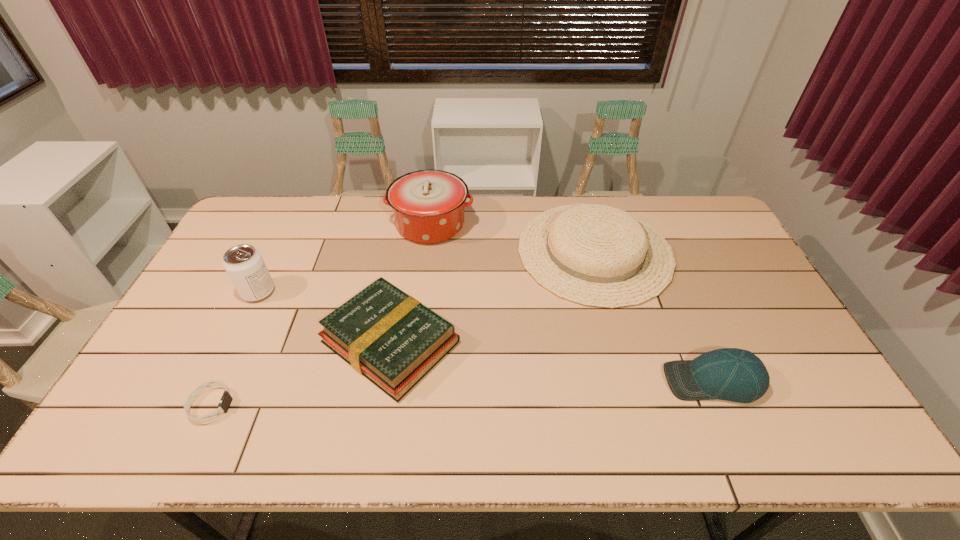
Find the location of a particular element. The image size is (960, 540). empty location between the shortest object and the casserole is located at coordinates (321, 315).

This screenshot has width=960, height=540. What are the coordinates of `free spot between the hardback book and the baseball cap` in the screenshot? It's located at (552, 361).

Where is `vacant area between the hardback book and the shortest object`? vacant area between the hardback book and the shortest object is located at coordinates (300, 374).

Identify which object is the second nearest to the soda can. Please provide its 2D coordinates. Your answer should be formatted as a tuple, i.e. [(x, y)], where the tuple contains the x and y coordinates of a point satisfying the conditions above.

[(226, 399)]

Choose which object is the third nearest neighbor to the sunhat. Please provide its 2D coordinates. Your answer should be formatted as a tuple, i.e. [(x, y)], where the tuple contains the x and y coordinates of a point satisfying the conditions above.

[(392, 339)]

I want to click on free point that satisfies the following two spatial constraints: 1. on the front side of the baseball cap; 2. on the left side of the casserole, so click(x=411, y=381).

In order to click on blank area in the image that satisfies the following two spatial constraints: 1. on the front side of the sunhat; 2. on the outer surface of the wristband in this screenshot , I will do `click(636, 406)`.